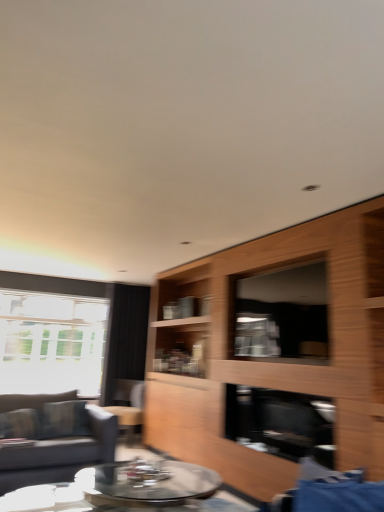
Question: Is clear glass coffee table at center a part of black glass fireplace at center?

Choices:
 (A) no
 (B) yes

Answer: (A)

Question: Is the depth of black glass fireplace at center less than that of clear glass coffee table at center?

Choices:
 (A) no
 (B) yes

Answer: (A)

Question: Is black glass fireplace at center oriented towards clear glass coffee table at center?

Choices:
 (A) yes
 (B) no

Answer: (B)

Question: From a real-world perspective, does black glass fireplace at center stand above clear glass coffee table at center?

Choices:
 (A) no
 (B) yes

Answer: (B)

Question: From a real-world perspective, is black glass fireplace at center beneath clear glass coffee table at center?

Choices:
 (A) yes
 (B) no

Answer: (B)

Question: Does black glass fireplace at center have a lesser height compared to clear glass coffee table at center?

Choices:
 (A) no
 (B) yes

Answer: (A)

Question: Is clear glass coffee table at center aimed at wooden cabinet at center?

Choices:
 (A) no
 (B) yes

Answer: (A)

Question: Is clear glass coffee table at center far from wooden cabinet at center?

Choices:
 (A) yes
 (B) no

Answer: (A)

Question: Does clear glass coffee table at center come behind wooden cabinet at center?

Choices:
 (A) yes
 (B) no

Answer: (A)

Question: Does clear glass coffee table at center have a lesser width compared to wooden cabinet at center?

Choices:
 (A) yes
 (B) no

Answer: (B)

Question: Can you confirm if clear glass coffee table at center is wider than wooden cabinet at center?

Choices:
 (A) no
 (B) yes

Answer: (B)

Question: From a real-world perspective, is clear glass coffee table at center positioned under wooden cabinet at center based on gravity?

Choices:
 (A) yes
 (B) no

Answer: (A)

Question: Can you confirm if wooden cabinet at center is wider than black fabric curtain at left?

Choices:
 (A) no
 (B) yes

Answer: (B)